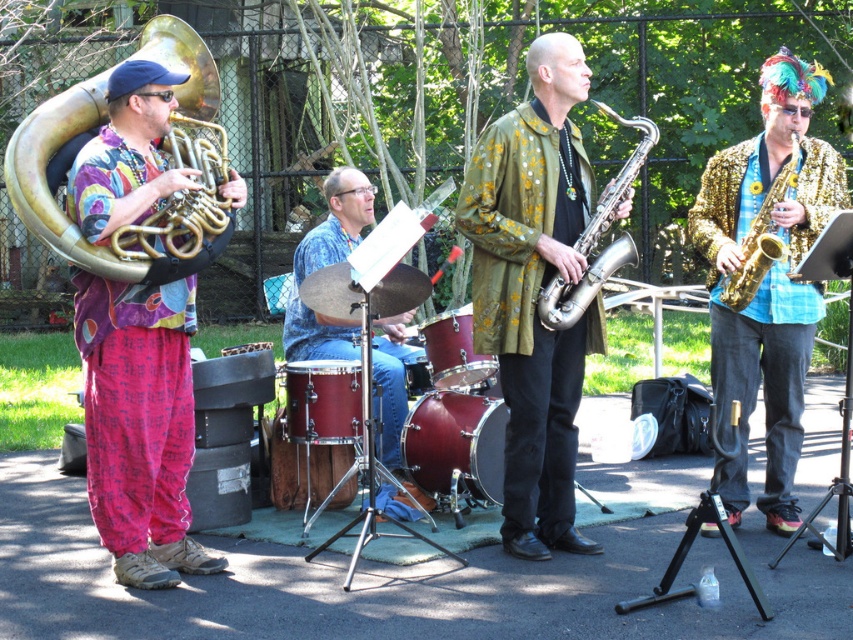
You are a stagehand setting up equipment for the musical performance. You need to place a microphone stand between the shiny red drum at center and the maroon drum at center. The stand requires at least 24 inches of space to fit. Can you fit the microphone stand between them?

The shiny red drum at center and maroon drum at center are 24.74 inches apart from each other. Since the required space is 24 inches, the microphone stand can be placed between them as the available space exceeds the minimum requirement.

You are standing in the park where the musical performance is happening. You want to take a photo of the gold brass tuba at left. Where should you position yourself to capture it in your shot?

To capture the gold brass tuba at left in your photo, position yourself at point (45, 180) where it is located.

You are a photographer standing in front of the gold brass tuba at left and the silver metallic saxophone at center. You want to take a photo that includes both instruments. Which instrument should you move closer to the camera to ensure both are fully visible in the frame?

The gold brass tuba at left is in front of the silver metallic saxophone at center, so you should move the silver metallic saxophone at center closer to the camera to ensure both are fully visible in the frame.